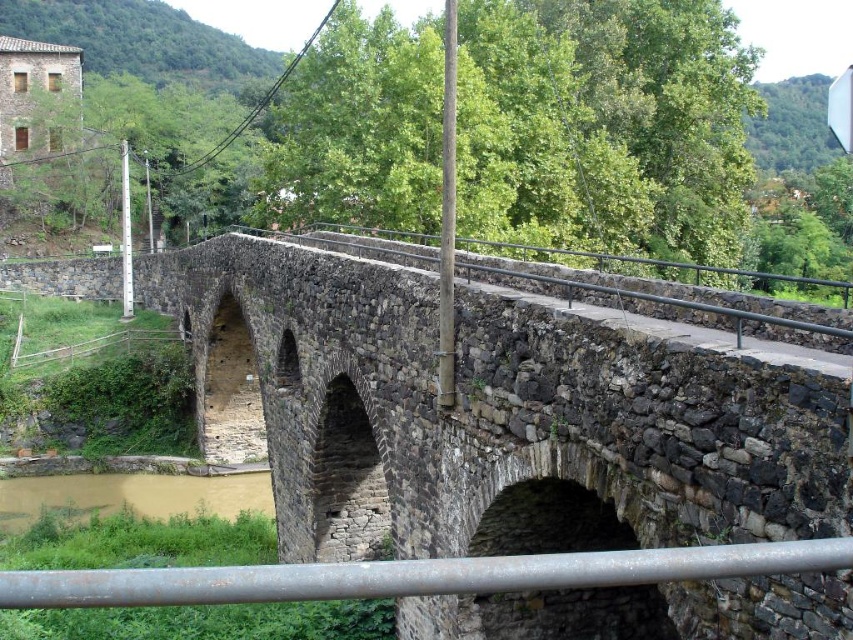
Which of these two, rusty metal rail at lower center or brown muddy water at lower left, stands taller?

With more height is rusty metal rail at lower center.

Is rusty metal rail at lower center to the left of brown muddy water at lower left from the viewer's perspective?

Incorrect, rusty metal rail at lower center is not on the left side of brown muddy water at lower left.

The height and width of the screenshot is (640, 853). Describe the element at coordinates (412, 576) in the screenshot. I see `rusty metal rail at lower center` at that location.

At what (x,y) coordinates should I click in order to perform the action: click on rusty metal rail at lower center. Please return your answer as a coordinate pair (x, y). Looking at the image, I should click on (412, 576).

Can you confirm if rustic stone bridge at center is bigger than rusty metal rail at lower center?

Correct, rustic stone bridge at center is larger in size than rusty metal rail at lower center.

Who is positioned more to the left, rustic stone bridge at center or rusty metal rail at lower center?

Positioned to the left is rustic stone bridge at center.

Locate an element on the screen. The image size is (853, 640). rustic stone bridge at center is located at coordinates (498, 404).

Between point (338, 404) and point (221, 480), which one is positioned behind?

The point (221, 480) is more distant.

Is point (483, 541) behind point (42, 492)?

No, (483, 541) is in front of (42, 492).

Where is `rustic stone bridge at center`? rustic stone bridge at center is located at coordinates (498, 404).